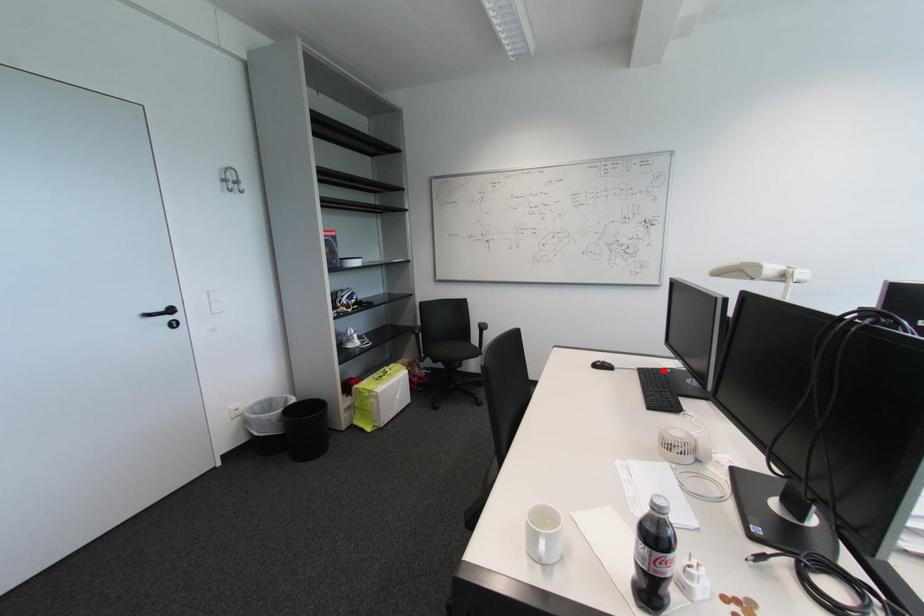
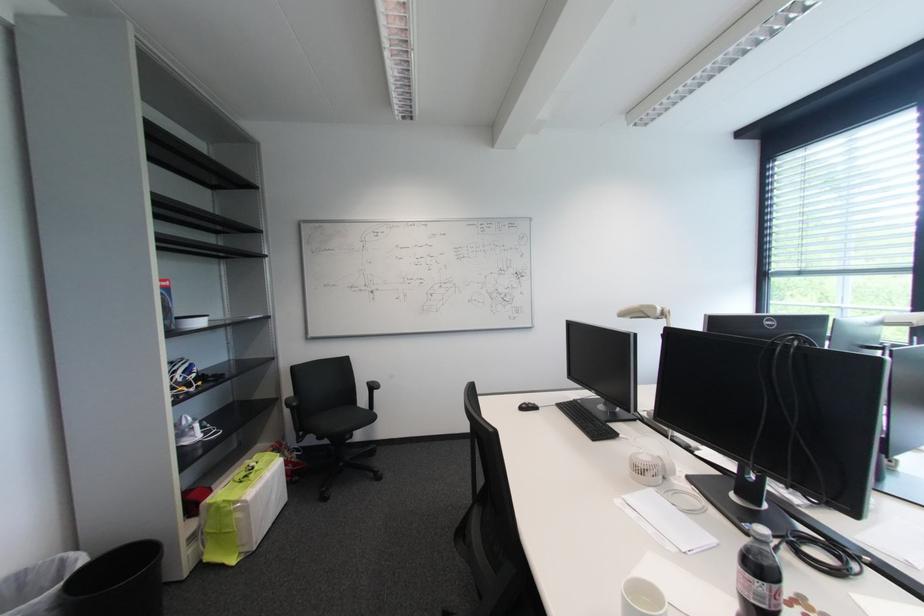
Question: I am providing you with two images of the same scene from different viewpoints. A red point is shown in image1. For the corresponding object point in image2, is it positioned nearer or farther from the camera?

Choices:
 (A) Nearer
 (B) Farther

Answer: (B)